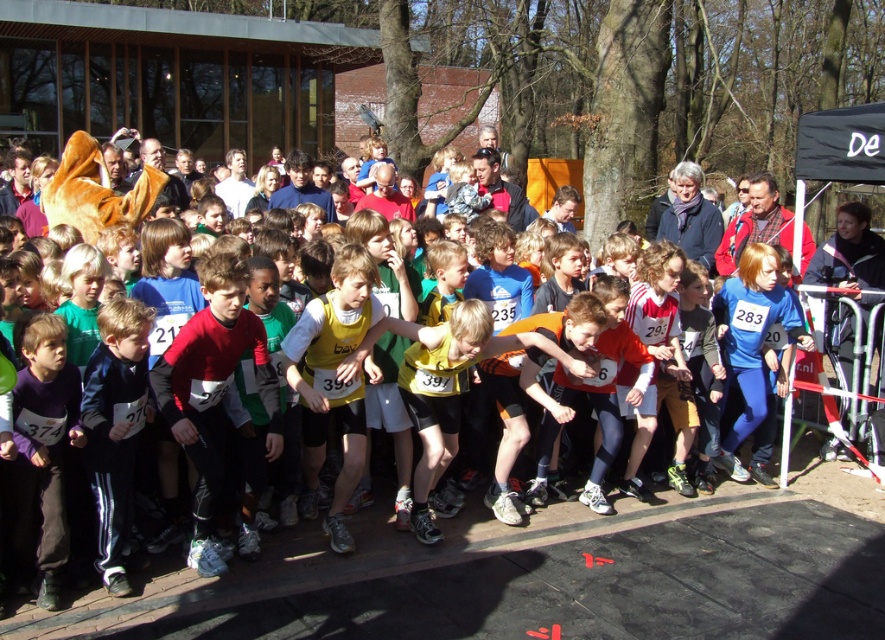
Question: Is yellow fabric shirt at center behind purple matte shirt at center?

Choices:
 (A) yes
 (B) no

Answer: (A)

Question: Does yellow fabric shirt at center appear over purple matte shirt at center?

Choices:
 (A) yes
 (B) no

Answer: (A)

Question: Can you confirm if purple matte shirt at center is smaller than dark blue tracksuit at center?

Choices:
 (A) no
 (B) yes

Answer: (B)

Question: Which object appears farthest from the camera in this image?

Choices:
 (A) yellow fabric shirt at center
 (B) dark blue tracksuit at center
 (C) purple matte shirt at center

Answer: (A)

Question: Among these objects, which one is farthest from the camera?

Choices:
 (A) dark blue tracksuit at center
 (B) purple matte shirt at center
 (C) yellow fabric shirt at center

Answer: (C)

Question: Which object is positioned farthest from the yellow fabric shirt at center?

Choices:
 (A) dark blue tracksuit at center
 (B) purple matte shirt at center

Answer: (B)